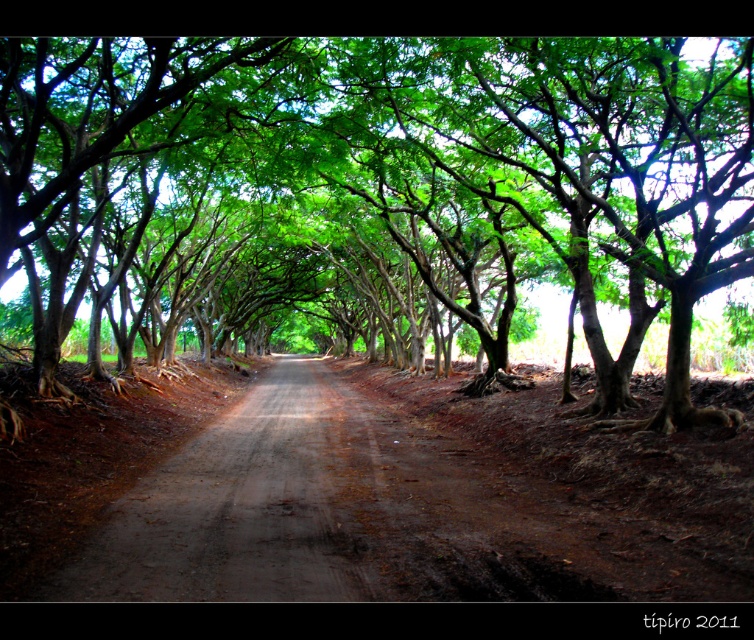
You are driving a car that is 3 meters wide. You want to drive through the gap between the two green leafy tree at center. Will your car fit through the gap?

The gap between the two green leafy tree at center is 7.40 meters wide, so the car can pass through since it is wider than the car.

You are driving along the dirt road at center and want to park your car on the side of the road. Which side of the road should you choose to ensure there is space between your car and the green leafy tree at center?

You should park on the right side of the dirt road at center because the green leafy tree at center is located to the left of the road, leaving more space on the right side for parking without being too close to the tree.

You are a hiker standing on the dirt road at center. You notice a green leafy tree at center above you. Which object is taller?

The green leafy tree at center is taller than the dirt road at center.